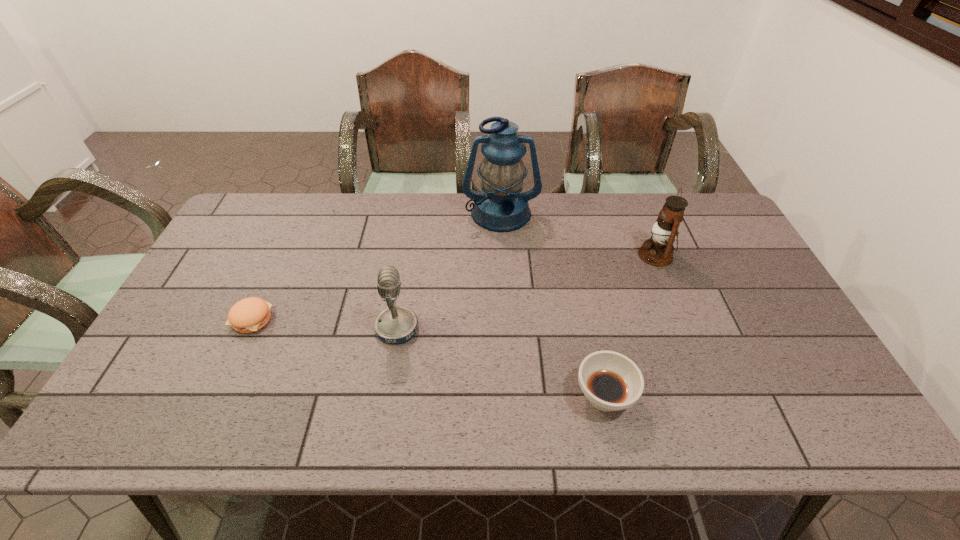
In the image, there is a desktop. Where is `free region at the near edge`? free region at the near edge is located at coordinates (486, 435).

In the image, there is a desktop. In order to click on free space at the left edge in this screenshot , I will do `click(196, 281)`.

In the image, there is a desktop. What are the coordinates of `vacant space at the right edge` in the screenshot? It's located at (741, 340).

Locate an element on the screen. This screenshot has width=960, height=540. free space between the fourth object from right to left and the shortest object is located at coordinates (324, 323).

Where is `free space between the right lantern and the fourth object from right to left`? free space between the right lantern and the fourth object from right to left is located at coordinates (526, 292).

Where is `vacant space that's between the fourth object from right to left and the nearer lantern`? vacant space that's between the fourth object from right to left and the nearer lantern is located at coordinates (526, 292).

Where is `vacant space that is in between the leftmost object and the microphone`? The image size is (960, 540). vacant space that is in between the leftmost object and the microphone is located at coordinates (324, 323).

This screenshot has height=540, width=960. Find the location of `free space between the right lantern and the leftmost object`. free space between the right lantern and the leftmost object is located at coordinates (453, 287).

Image resolution: width=960 pixels, height=540 pixels. What are the coordinates of `free space that is in between the taller lantern and the shortest object` in the screenshot? It's located at (376, 266).

Where is `vacant point located between the right lantern and the second object from left to right`? Image resolution: width=960 pixels, height=540 pixels. vacant point located between the right lantern and the second object from left to right is located at coordinates (526, 292).